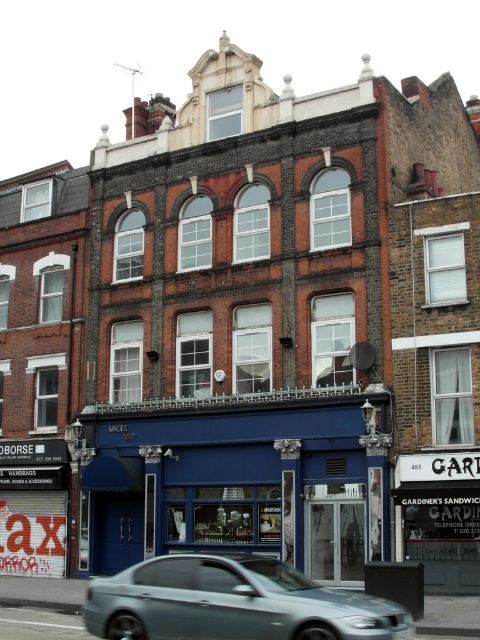
Question: Which point is farther from the camera taking this photo?

Choices:
 (A) click(238, 576)
 (B) click(108, 557)

Answer: (B)

Question: Can you confirm if blue matte storefront at center is smaller than metallic silver sedan at center?

Choices:
 (A) no
 (B) yes

Answer: (B)

Question: Can you confirm if blue matte storefront at center is wider than metallic silver sedan at center?

Choices:
 (A) no
 (B) yes

Answer: (B)

Question: Does blue matte storefront at center appear over metallic silver sedan at center?

Choices:
 (A) yes
 (B) no

Answer: (A)

Question: Among these points, which one is nearest to the camera?

Choices:
 (A) (357, 433)
 (B) (324, 611)

Answer: (B)